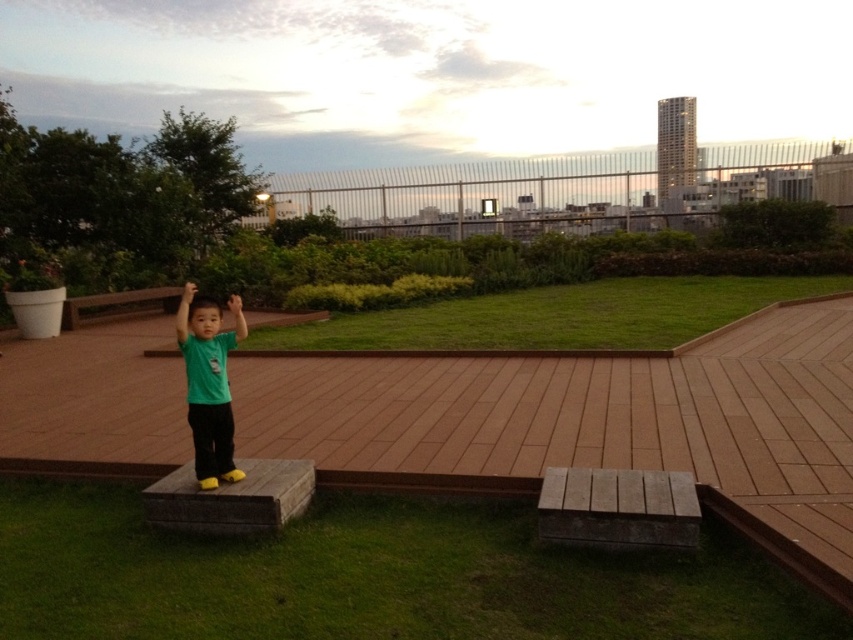
Question: Can you confirm if brown wood deck at center is thinner than green matte shirt at center?

Choices:
 (A) yes
 (B) no

Answer: (B)

Question: Among these objects, which one is nearest to the camera?

Choices:
 (A) green matte shirt at center
 (B) brown wood deck at center

Answer: (B)

Question: Can you confirm if brown wood deck at center is positioned below green matte shirt at center?

Choices:
 (A) no
 (B) yes

Answer: (B)

Question: Among these points, which one is farthest from the camera?

Choices:
 (A) pos(286,426)
 (B) pos(213,448)

Answer: (A)

Question: Can you confirm if brown wood deck at center is positioned below green matte shirt at center?

Choices:
 (A) yes
 (B) no

Answer: (A)